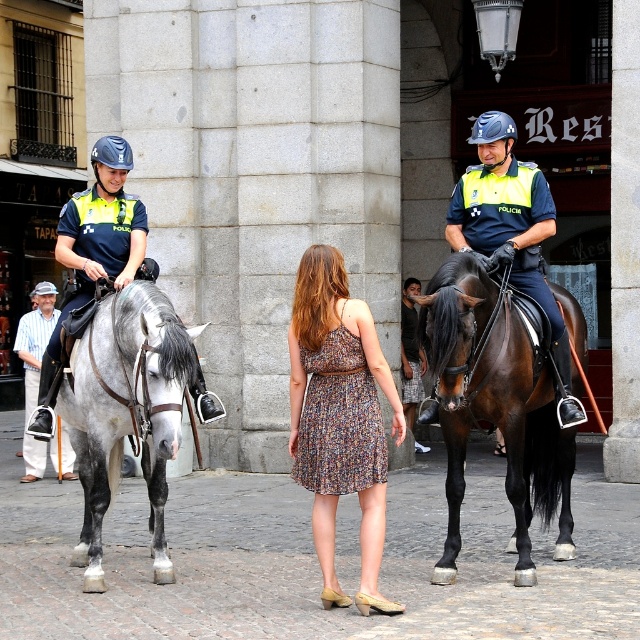
You are a photographer trying to capture a photo of the brown glossy horse at center and the matte black helmet at upper left. Which object should you focus on first if you want to ensure both are in focus, considering their sizes in the frame?

The brown glossy horse at center is taller than the matte black helmet at upper left, so you should focus on the brown glossy horse at center first as it is larger and requires more precise focus to ensure both are in focus.

You are a photographer trying to capture a wide shot of the scene. You need to ensure that both the brown glossy horse at center and the matte black helmet at upper left are fully visible in the frame. Given their sizes, which object will require more horizontal space in the photo?

The brown glossy horse at center requires more horizontal space in the photo because its width surpasses that of the matte black helmet at upper left.